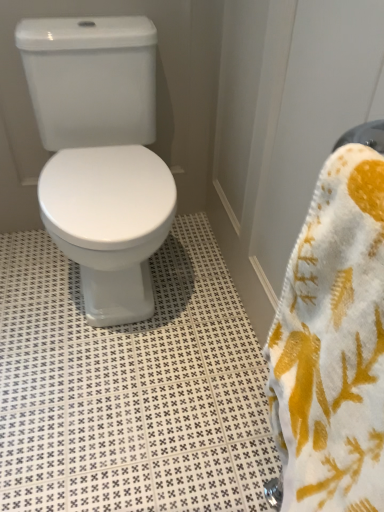
Identify the location of free space in front of white glossy toilet at center. (115, 406).